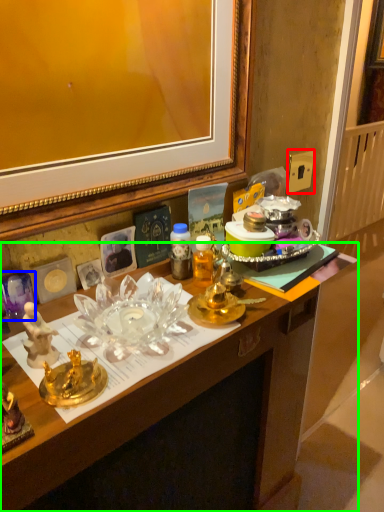
Question: Considering the real-world distances, which object is farthest from power outlet (highlighted by a red box)? plate (highlighted by a blue box) or desk (highlighted by a green box)?

Choices:
 (A) plate
 (B) desk

Answer: (A)